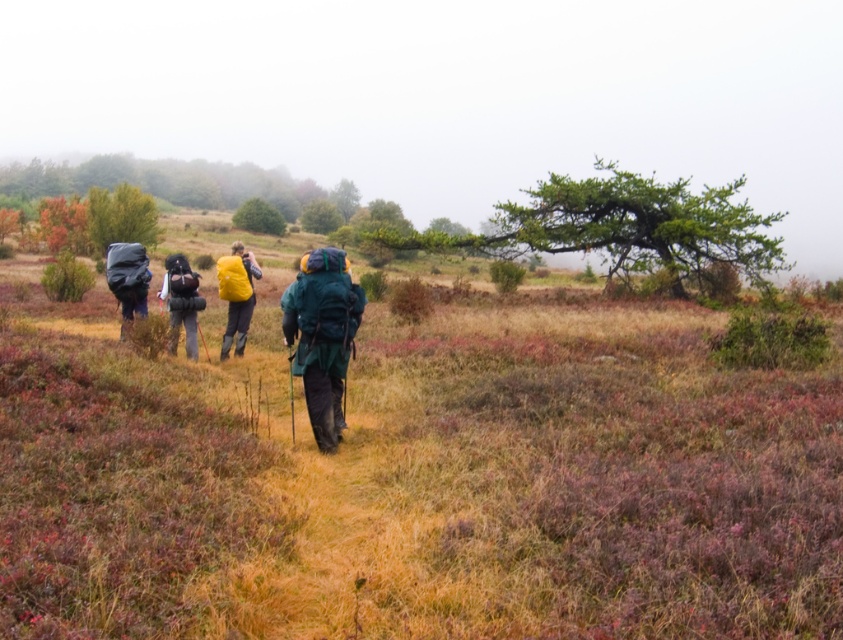
You are a hiker planning to carry both the green fabric backpack at center and the matte black backpack at center on a trail. Given their sizes, which one might be harder to fit into a narrow space like a backpack compartment?

Answer: The matte black backpack at center occupies more space than the green fabric backpack at center, so it might be harder to fit into a narrow space like a backpack compartment.

You are a hiker trying to locate your gear. You see a green fabric backpack at center and a matte black backpack at left. Which backpack is closer to the right side of the image?

The green fabric backpack at center is positioned on the right side of the matte black backpack at left, so it is closer to the right side of the image.